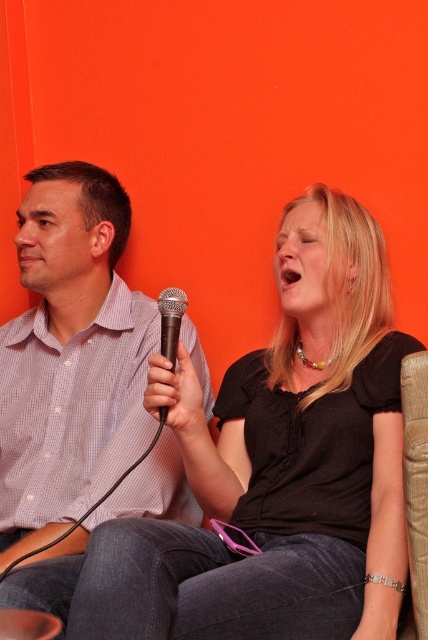
Question: Which point is closer to the camera?

Choices:
 (A) black metallic microphone at center
 (B) matte black microphone at center
 (C) checkered fabric shirt at left

Answer: (B)

Question: Can you confirm if checkered fabric shirt at left is positioned above black metallic microphone at center?

Choices:
 (A) no
 (B) yes

Answer: (B)

Question: Among these points, which one is nearest to the camera?

Choices:
 (A) (165, 294)
 (B) (0, 428)
 (C) (397, 515)

Answer: (C)

Question: Is matte black microphone at center above checkered fabric shirt at left?

Choices:
 (A) no
 (B) yes

Answer: (A)

Question: Does checkered fabric shirt at left have a smaller size compared to black metallic microphone at center?

Choices:
 (A) no
 (B) yes

Answer: (A)

Question: Which object is positioned farthest from the matte black microphone at center?

Choices:
 (A) black metallic microphone at center
 (B) checkered fabric shirt at left

Answer: (B)